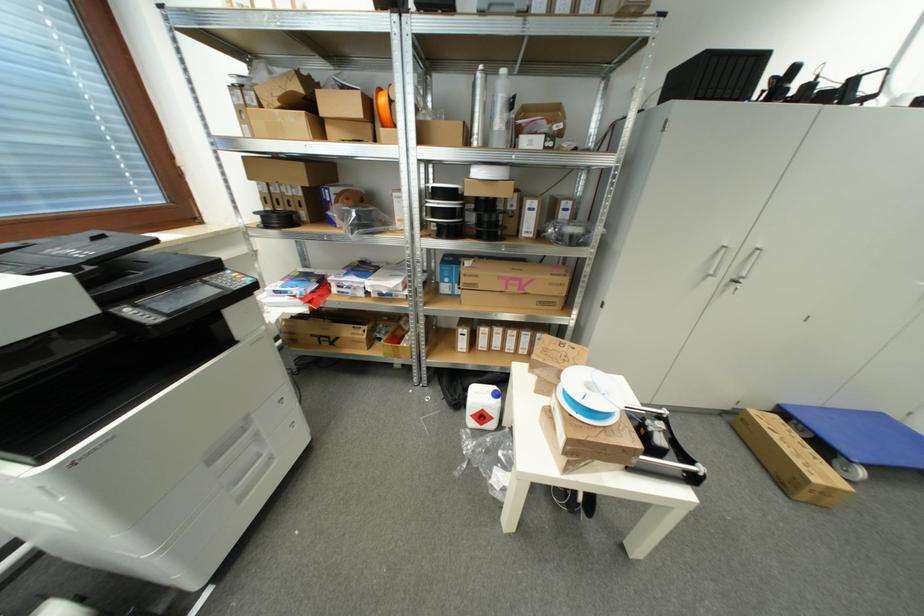
The height and width of the screenshot is (616, 924). What do you see at coordinates (858, 438) in the screenshot? I see `the blue moving dolly` at bounding box center [858, 438].